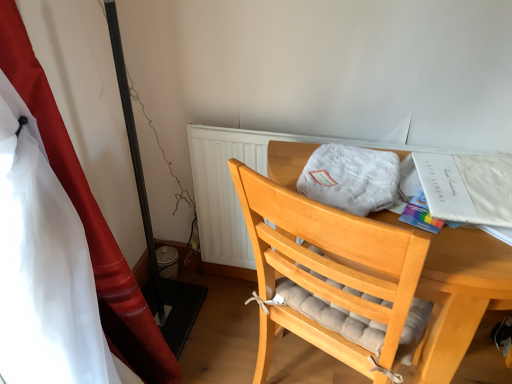
Question: Is white paper at upper right closer to the viewer compared to red satin curtain at left?

Choices:
 (A) yes
 (B) no

Answer: (B)

Question: From the image's perspective, is white paper at upper right under red satin curtain at left?

Choices:
 (A) no
 (B) yes

Answer: (A)

Question: Considering the relative positions of white paper at upper right and red satin curtain at left in the image provided, is white paper at upper right to the left of red satin curtain at left from the viewer's perspective?

Choices:
 (A) yes
 (B) no

Answer: (B)

Question: Can you confirm if white paper at upper right is thinner than red satin curtain at left?

Choices:
 (A) yes
 (B) no

Answer: (A)

Question: Is white paper at upper right turned away from red satin curtain at left?

Choices:
 (A) no
 (B) yes

Answer: (A)

Question: Looking at the image, does red satin curtain at left seem bigger or smaller compared to white paper at upper right?

Choices:
 (A) small
 (B) big

Answer: (B)

Question: In terms of height, does red satin curtain at left look taller or shorter compared to white paper at upper right?

Choices:
 (A) tall
 (B) short

Answer: (A)

Question: From the image's perspective, is red satin curtain at left positioned above or below white paper at upper right?

Choices:
 (A) below
 (B) above

Answer: (A)

Question: Is point (145, 324) positioned closer to the camera than point (415, 158)?

Choices:
 (A) closer
 (B) farther

Answer: (B)

Question: From a real-world perspective, is white paper at upper right physically located above or below white fluffy blanket at center?

Choices:
 (A) above
 (B) below

Answer: (A)

Question: From the image's perspective, is white paper at upper right above or below white fluffy blanket at center?

Choices:
 (A) above
 (B) below

Answer: (B)

Question: Looking at the image, does white paper at upper right seem bigger or smaller compared to white fluffy blanket at center?

Choices:
 (A) big
 (B) small

Answer: (B)

Question: From their relative heights in the image, would you say white paper at upper right is taller or shorter than white fluffy blanket at center?

Choices:
 (A) short
 (B) tall

Answer: (A)

Question: Based on their positions, is red satin curtain at left located to the left or right of white fluffy blanket at center?

Choices:
 (A) right
 (B) left

Answer: (B)

Question: Is point (64, 158) positioned closer to the camera than point (371, 193)?

Choices:
 (A) closer
 (B) farther

Answer: (B)